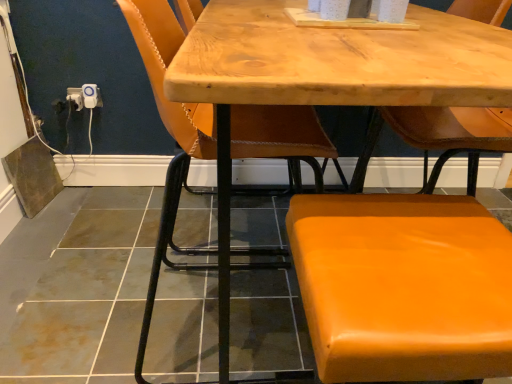
Where is `wooden table at center`? wooden table at center is located at coordinates (338, 60).

You are a GUI agent. You are given a task and a screenshot of the screen. Output one action in this format:
    pyautogui.click(x=<x>, y=<y>)
    Task: Click on the white plastic electrical outlet at lower left, which is counted as the 1th electric outlet, starting from the left
    This screenshot has height=384, width=512.
    Given the screenshot: What is the action you would take?
    click(x=75, y=97)

Is white plastic outlet at lower left, arranged as the second electric outlet when viewed from the left, at the left side of wooden table at center?

Correct, you'll find white plastic outlet at lower left, arranged as the second electric outlet when viewed from the left, to the left of wooden table at center.

Locate an element on the screen. the 1st electric outlet positioned below the wooden table at center (from a real-world perspective) is located at coordinates coord(85,96).

How far apart are white plastic outlet at lower left, arranged as the 1th electric outlet when viewed from the right, and wooden table at center?

The distance of white plastic outlet at lower left, arranged as the 1th electric outlet when viewed from the right, from wooden table at center is 1.32 meters.

How different are the orientations of orange leather chair at center, placed as the second chair when sorted from right to left, and orange leather stool at lower right, acting as the first chair starting from the right, in degrees?

The angle between the facing direction of orange leather chair at center, placed as the second chair when sorted from right to left, and the facing direction of orange leather stool at lower right, acting as the first chair starting from the right, is 89.1 degrees.

Considering the sizes of objects orange leather chair at center, placed as the second chair when sorted from right to left, and orange leather stool at lower right, acting as the first chair starting from the right, in the image provided, who is thinner, orange leather chair at center, placed as the second chair when sorted from right to left, or orange leather stool at lower right, acting as the first chair starting from the right,?

orange leather stool at lower right, acting as the first chair starting from the right, is thinner.

Would you say orange leather chair at center, placed as the second chair when sorted from right to left, is to the left or to the right of orange leather stool at lower right, acting as the first chair starting from the right, in the picture?

Based on their positions, orange leather chair at center, placed as the second chair when sorted from right to left, is located to the left of orange leather stool at lower right, acting as the first chair starting from the right.

Is there a large distance between orange leather chair at center, placed as the second chair when sorted from right to left, and orange leather stool at lower right, which ranks as the 2th chair in left-to-right order?

No.

Is orange leather stool at lower right, acting as the first chair starting from the right, next to wooden table at center?

No, orange leather stool at lower right, acting as the first chair starting from the right, is not with wooden table at center.

From a real-world perspective, which is physically above, orange leather stool at lower right, acting as the first chair starting from the right, or wooden table at center?

wooden table at center is physically above.

Which is in front, orange leather stool at lower right, acting as the first chair starting from the right, or wooden table at center?

orange leather stool at lower right, acting as the first chair starting from the right, is closer to the camera.

Which point is more distant from viewer, (70, 97) or (188, 109)?

The point (70, 97) is more distant.

Is white plastic outlet at lower left, arranged as the 1th electric outlet when viewed from the right, not inside orange leather chair at center, the 1th chair from the left?

Yes, white plastic outlet at lower left, arranged as the 1th electric outlet when viewed from the right, is not within orange leather chair at center, the 1th chair from the left.

From the image's perspective, is white plastic outlet at lower left, arranged as the second electric outlet when viewed from the left, under orange leather chair at center, the 1th chair from the left?

No, from the image's perspective, white plastic outlet at lower left, arranged as the second electric outlet when viewed from the left, is not below orange leather chair at center, the 1th chair from the left.

Is orange leather chair at center, placed as the second chair when sorted from right to left, at the back of white plastic outlet at lower left, arranged as the second electric outlet when viewed from the left?

No, orange leather chair at center, placed as the second chair when sorted from right to left, is not at the back of white plastic outlet at lower left, arranged as the second electric outlet when viewed from the left.

Between orange leather chair at center, placed as the second chair when sorted from right to left, and white plastic outlet at lower left, arranged as the 1th electric outlet when viewed from the right, which one appears on the right side from the viewer's perspective?

Positioned to the right is orange leather chair at center, placed as the second chair when sorted from right to left.

From their relative heights in the image, would you say orange leather chair at center, placed as the second chair when sorted from right to left, is taller or shorter than white plastic outlet at lower left, arranged as the second electric outlet when viewed from the left?

Clearly, orange leather chair at center, placed as the second chair when sorted from right to left, is taller compared to white plastic outlet at lower left, arranged as the second electric outlet when viewed from the left.

How many degrees apart are the facing directions of orange leather chair at center, the 1th chair from the left, and white plastic outlet at lower left, arranged as the 1th electric outlet when viewed from the right?

90.6 degrees separate the facing orientations of orange leather chair at center, the 1th chair from the left, and white plastic outlet at lower left, arranged as the 1th electric outlet when viewed from the right.

Is orange leather chair at center, placed as the second chair when sorted from right to left, facing away from white plastic outlet at lower left, arranged as the second electric outlet when viewed from the left?

orange leather chair at center, placed as the second chair when sorted from right to left, does not have its back to white plastic outlet at lower left, arranged as the second electric outlet when viewed from the left.

How much distance is there between orange leather chair at center, the 1th chair from the left, and white plastic electrical outlet at lower left, arranged as the second electric outlet when viewed from the right?

They are 32.10 inches apart.

From a real-world perspective, is orange leather chair at center, the 1th chair from the left, on white plastic electrical outlet at lower left, arranged as the second electric outlet when viewed from the right?

Indeed, from a real-world perspective, orange leather chair at center, the 1th chair from the left, stands above white plastic electrical outlet at lower left, arranged as the second electric outlet when viewed from the right.

Between orange leather chair at center, the 1th chair from the left, and white plastic electrical outlet at lower left, which is counted as the 1th electric outlet, starting from the left, which one has less height?

With less height is white plastic electrical outlet at lower left, which is counted as the 1th electric outlet, starting from the left.

Is orange leather chair at center, placed as the second chair when sorted from right to left, not within white plastic electrical outlet at lower left, which is counted as the 1th electric outlet, starting from the left?

orange leather chair at center, placed as the second chair when sorted from right to left, lies outside white plastic electrical outlet at lower left, which is counted as the 1th electric outlet, starting from the left,'s area.

Can we say white plastic outlet at lower left, arranged as the second electric outlet when viewed from the left, lies outside white plastic electrical outlet at lower left, arranged as the second electric outlet when viewed from the right?

That's correct, white plastic outlet at lower left, arranged as the second electric outlet when viewed from the left, is outside of white plastic electrical outlet at lower left, arranged as the second electric outlet when viewed from the right.

Can you tell me how much white plastic outlet at lower left, arranged as the 1th electric outlet when viewed from the right, and white plastic electrical outlet at lower left, which is counted as the 1th electric outlet, starting from the left, differ in facing direction?

0.139 degrees.

Is point (75, 98) closer or farther from the camera than point (78, 95)?

Clearly, point (75, 98) is more distant from the camera than point (78, 95).

Is white plastic outlet at lower left, arranged as the 1th electric outlet when viewed from the right, oriented towards white plastic electrical outlet at lower left, arranged as the second electric outlet when viewed from the right?

Yes, white plastic outlet at lower left, arranged as the 1th electric outlet when viewed from the right, faces towards white plastic electrical outlet at lower left, arranged as the second electric outlet when viewed from the right.

The width and height of the screenshot is (512, 384). In order to click on table to the right of white plastic outlet at lower left, arranged as the 1th electric outlet when viewed from the right in this screenshot , I will do `click(338, 60)`.

Image resolution: width=512 pixels, height=384 pixels. I want to click on chair above the orange leather stool at lower right, which ranks as the 2th chair in left-to-right order (from a real-world perspective), so click(172, 136).

When comparing their distances from orange leather stool at lower right, which ranks as the 2th chair in left-to-right order, does white plastic electrical outlet at lower left, arranged as the second electric outlet when viewed from the right, or orange leather chair at center, the 1th chair from the left, seem closer?

orange leather chair at center, the 1th chair from the left, is closer to orange leather stool at lower right, which ranks as the 2th chair in left-to-right order.

Considering their positions, is white plastic outlet at lower left, arranged as the 1th electric outlet when viewed from the right, positioned further to white plastic electrical outlet at lower left, which is counted as the 1th electric outlet, starting from the left, than wooden table at center?

Among the two, wooden table at center is located further to white plastic electrical outlet at lower left, which is counted as the 1th electric outlet, starting from the left.

Based on the photo, looking at the image, which one is located further to white plastic outlet at lower left, arranged as the 1th electric outlet when viewed from the right, orange leather stool at lower right, which ranks as the 2th chair in left-to-right order, or white plastic electrical outlet at lower left, which is counted as the 1th electric outlet, starting from the left?

orange leather stool at lower right, which ranks as the 2th chair in left-to-right order, lies further to white plastic outlet at lower left, arranged as the 1th electric outlet when viewed from the right, than the other object.

Which object lies nearer to the anchor point white plastic electrical outlet at lower left, which is counted as the 1th electric outlet, starting from the left, orange leather stool at lower right, acting as the first chair starting from the right, or wooden table at center?

wooden table at center is positioned closer to the anchor white plastic electrical outlet at lower left, which is counted as the 1th electric outlet, starting from the left.

Which object lies nearer to the anchor point white plastic outlet at lower left, arranged as the second electric outlet when viewed from the left, orange leather stool at lower right, which ranks as the 2th chair in left-to-right order, or orange leather chair at center, the 1th chair from the left?

orange leather chair at center, the 1th chair from the left.

Looking at the image, which one is located further to orange leather chair at center, the 1th chair from the left, wooden table at center or white plastic electrical outlet at lower left, arranged as the second electric outlet when viewed from the right?

Based on the image, wooden table at center appears to be further to orange leather chair at center, the 1th chair from the left.

Looking at the image, which one is located further to wooden table at center, orange leather stool at lower right, which ranks as the 2th chair in left-to-right order, or white plastic outlet at lower left, arranged as the 1th electric outlet when viewed from the right?

white plastic outlet at lower left, arranged as the 1th electric outlet when viewed from the right, is further to wooden table at center.

When comparing their distances from orange leather chair at center, the 1th chair from the left, does white plastic electrical outlet at lower left, arranged as the second electric outlet when viewed from the right, or orange leather stool at lower right, acting as the first chair starting from the right, seem further?

Among the two, orange leather stool at lower right, acting as the first chair starting from the right, is located further to orange leather chair at center, the 1th chair from the left.

Identify the location of chair between wooden table at center and white plastic outlet at lower left, arranged as the 1th electric outlet when viewed from the right, along the z-axis. The height and width of the screenshot is (384, 512). (172, 136).

In order to click on table located between orange leather stool at lower right, acting as the first chair starting from the right, and white plastic electrical outlet at lower left, arranged as the second electric outlet when viewed from the right, in the depth direction in this screenshot , I will do `click(338, 60)`.

Where is `chair between wooden table at center and white plastic electrical outlet at lower left, arranged as the second electric outlet when viewed from the right, along the z-axis`? The height and width of the screenshot is (384, 512). chair between wooden table at center and white plastic electrical outlet at lower left, arranged as the second electric outlet when viewed from the right, along the z-axis is located at coordinates (172, 136).

I want to click on chair positioned between orange leather stool at lower right, acting as the first chair starting from the right, and white plastic electrical outlet at lower left, arranged as the second electric outlet when viewed from the right, from near to far, so click(172, 136).